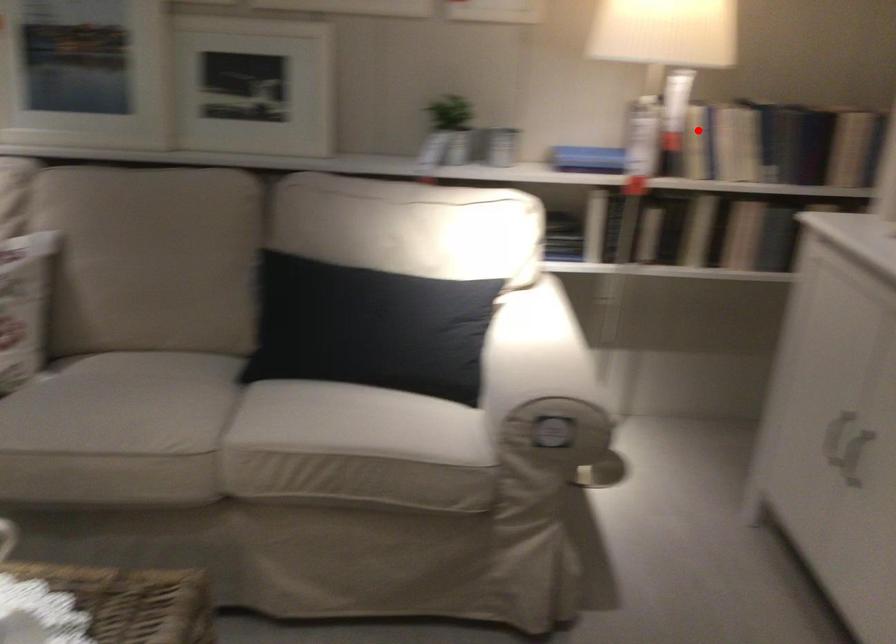
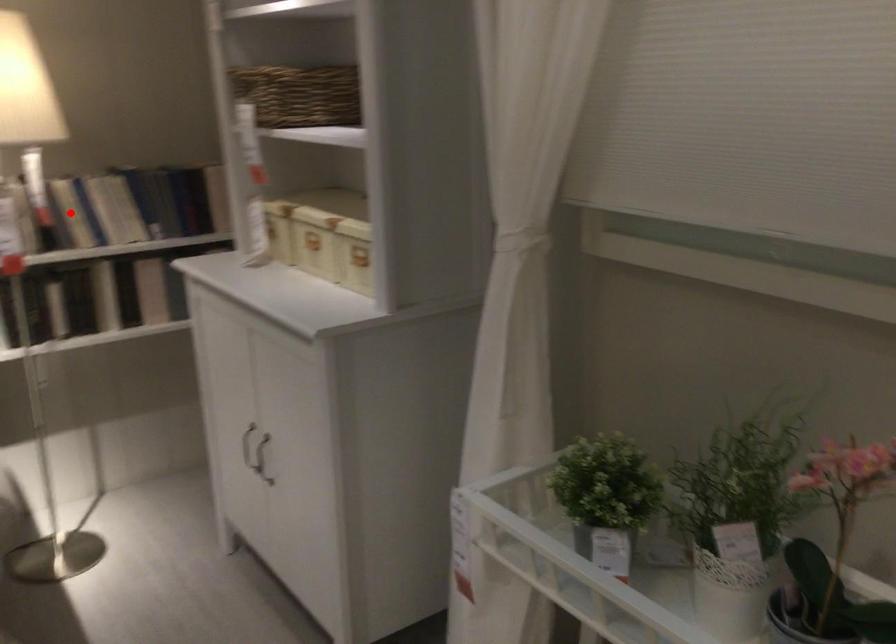
I am providing you with two images of the same scene from different viewpoints. A red point is marked on the first image and another point is marked on the second image. Is the red point in image1 aligned with the point shown in image2?

Yes